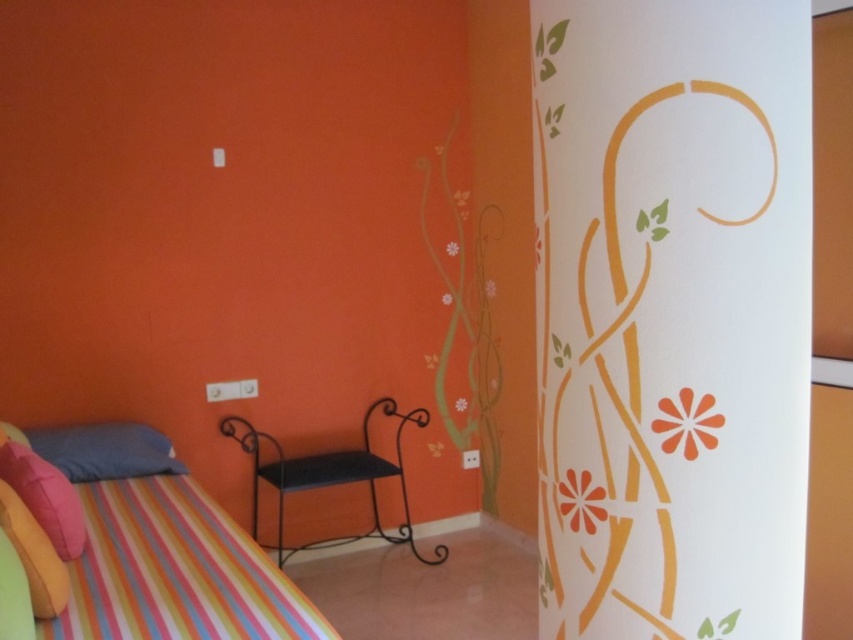
You are a delivery person who just brought a small package to this room. The package needs to be placed between the striped fabric bed at lower left and the matte blue pillow at lower left. Is there enough space to place the package there?

The distance between the striped fabric bed at lower left and the matte blue pillow at lower left is 14.29 inches, so there is enough space to place the package between them.